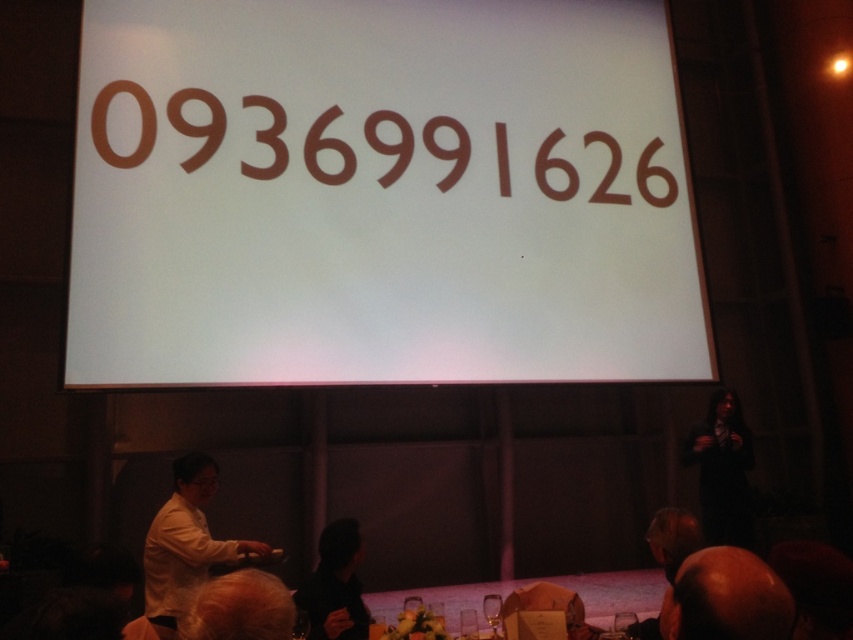
How far apart are white glossy table at lower center and blonde hair at lower center?

The distance of white glossy table at lower center from blonde hair at lower center is 3.00 meters.

How distant is white glossy table at lower center from blonde hair at lower center?

white glossy table at lower center and blonde hair at lower center are 3.00 meters apart.

Is point (364, 593) in front of point (184, 636)?

No, it is behind (184, 636).

Where is `white glossy table at lower center`? This screenshot has height=640, width=853. white glossy table at lower center is located at coordinates (532, 582).

Which of these two, white matte shirt at lower left or white glossy table at lower center, stands taller?

Standing taller between the two is white matte shirt at lower left.

Is point (154, 564) less distant than point (556, 580)?

Yes, it is in front of point (556, 580).

Locate an element on the screen. The height and width of the screenshot is (640, 853). white matte shirt at lower left is located at coordinates (184, 544).

Which is more to the left, brown paper-like at upper center or dark fabric jacket at lower right?

brown paper-like at upper center is more to the left.

The height and width of the screenshot is (640, 853). In order to click on brown paper-like at upper center in this screenshot , I will do `click(380, 195)`.